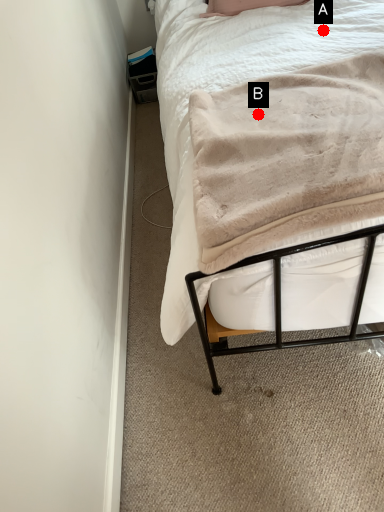
Question: Two points are circled on the image, labeled by A and B beside each circle. Which point is farther from the camera taking this photo?

Choices:
 (A) A is further
 (B) B is further

Answer: (A)